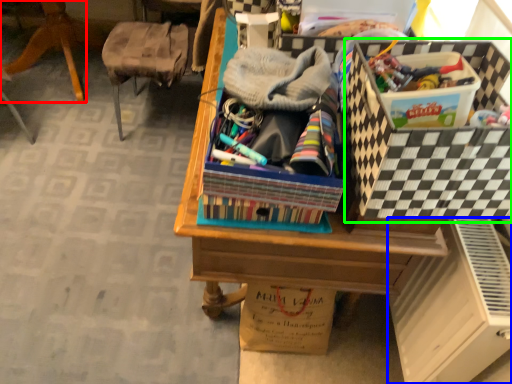
Question: Which is farther away from furniture (highlighted by a red box)? file cabinet (highlighted by a blue box) or storage box (highlighted by a green box)?

Choices:
 (A) file cabinet
 (B) storage box

Answer: (A)